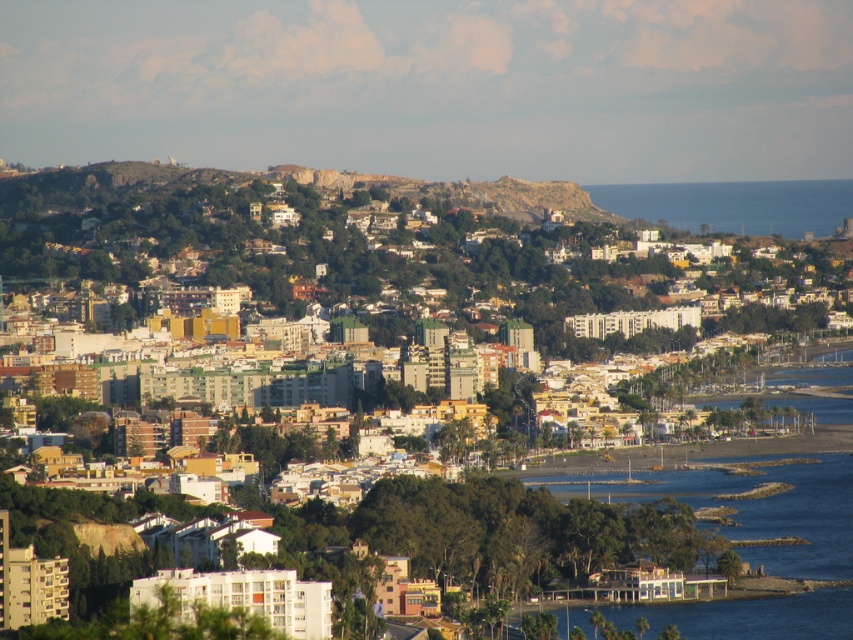
Question: Which is farther from the blue water at lower right?

Choices:
 (A) blue water at right
 (B) multicolored buildings at center

Answer: (A)

Question: Is multicolored buildings at center to the right of blue water at lower right from the viewer's perspective?

Choices:
 (A) yes
 (B) no

Answer: (B)

Question: Which point is closer to the camera?

Choices:
 (A) (808, 307)
 (B) (822, 228)
 (C) (810, 497)

Answer: (A)

Question: Is blue water at lower right smaller than blue water at right?

Choices:
 (A) no
 (B) yes

Answer: (A)

Question: Based on their relative distances, which object is farther from the blue water at right?

Choices:
 (A) blue water at lower right
 (B) multicolored buildings at center

Answer: (A)

Question: From the image, what is the correct spatial relationship of blue water at lower right in relation to blue water at right?

Choices:
 (A) right
 (B) left

Answer: (B)